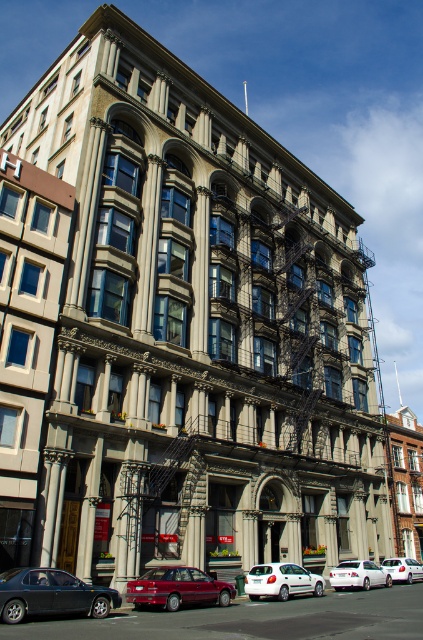
Is point (21, 588) less distant than point (129, 595)?

Yes, it is.

What do you see at coordinates (51, 595) in the screenshot? I see `matte black sedan at lower left` at bounding box center [51, 595].

At what (x,y) coordinates should I click in order to perform the action: click on matte black sedan at lower left. Please return your answer as a coordinate pair (x, y). This screenshot has width=423, height=640. Looking at the image, I should click on (51, 595).

Can you confirm if matte black sedan at lower left is wider than white matte hatchback at center?

In fact, matte black sedan at lower left might be narrower than white matte hatchback at center.

The image size is (423, 640). What do you see at coordinates (51, 595) in the screenshot? I see `matte black sedan at lower left` at bounding box center [51, 595].

I want to click on matte black sedan at lower left, so click(51, 595).

I want to click on matte black sedan at lower left, so click(x=51, y=595).

The width and height of the screenshot is (423, 640). What do you see at coordinates (51, 595) in the screenshot? I see `matte black sedan at lower left` at bounding box center [51, 595].

Is point (115, 589) behind point (403, 576)?

No, (115, 589) is closer to viewer.

Is point (43, 582) positioned in front of point (417, 563)?

Yes.

This screenshot has width=423, height=640. Find the location of `matte black sedan at lower left`. matte black sedan at lower left is located at coordinates (51, 595).